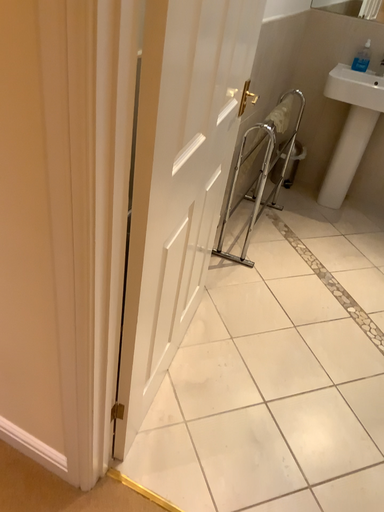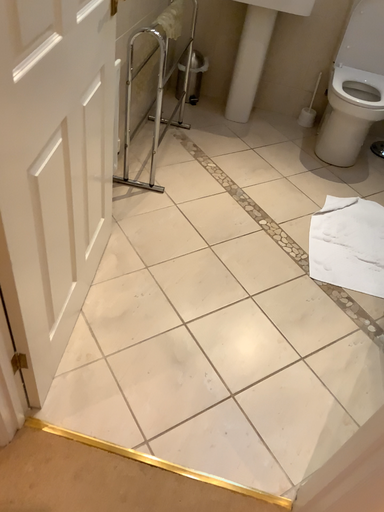
Question: How did the camera likely rotate when shooting the video?

Choices:
 (A) rotated left
 (B) rotated right

Answer: (B)